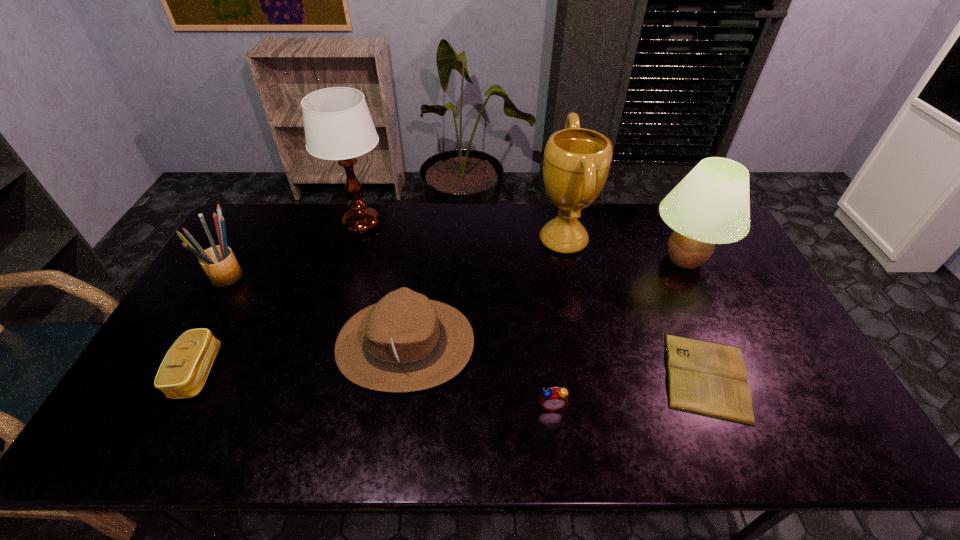
Locate an element on the screen. This screenshot has height=540, width=960. table lamp is located at coordinates (338, 126).

This screenshot has width=960, height=540. Identify the location of award. (577, 161).

Locate an element on the screen. The width and height of the screenshot is (960, 540). lampshade is located at coordinates (711, 205).

At what (x,y) coordinates should I click in order to perform the action: click on the fifth shortest object. Please return your answer as a coordinate pair (x, y). The height and width of the screenshot is (540, 960). Looking at the image, I should click on pos(219,263).

Identify the location of fedora. Image resolution: width=960 pixels, height=540 pixels. (406, 342).

Identify the location of alarm clock. This screenshot has width=960, height=540. (553, 399).

This screenshot has width=960, height=540. I want to click on clutch bag, so click(x=182, y=374).

Image resolution: width=960 pixels, height=540 pixels. Identify the location of book. (705, 378).

Locate an element on the screen. vacant space located 0.050m on the front of the table lamp is located at coordinates pyautogui.click(x=352, y=254).

Where is `free spot located on the front of the award with the decoration`? This screenshot has height=540, width=960. free spot located on the front of the award with the decoration is located at coordinates (437, 240).